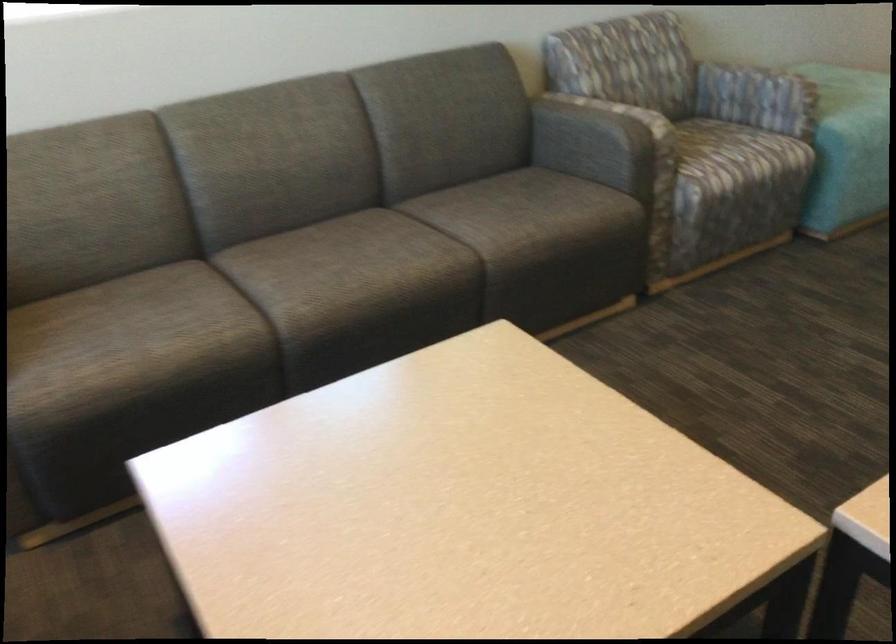
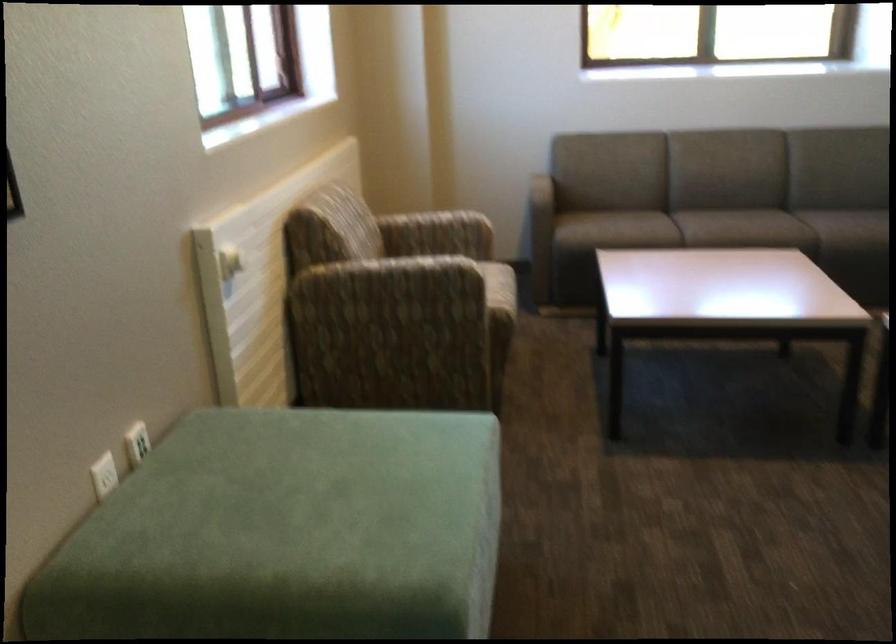
Where in the second image is the point corresponding to point (435, 258) from the first image?

(780, 229)